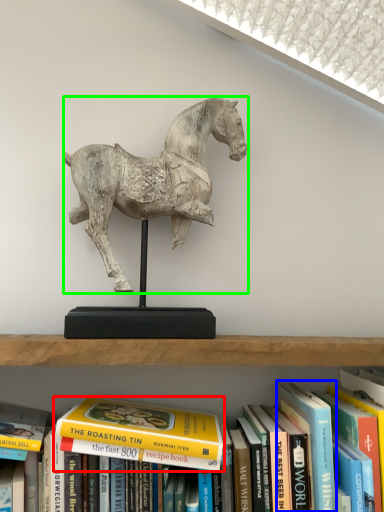
Question: Based on their relative distances, which object is farther from book (highlighted by a red box)? Choose from paperback book (highlighted by a blue box) and horse (highlighted by a green box).

Choices:
 (A) paperback book
 (B) horse

Answer: (B)